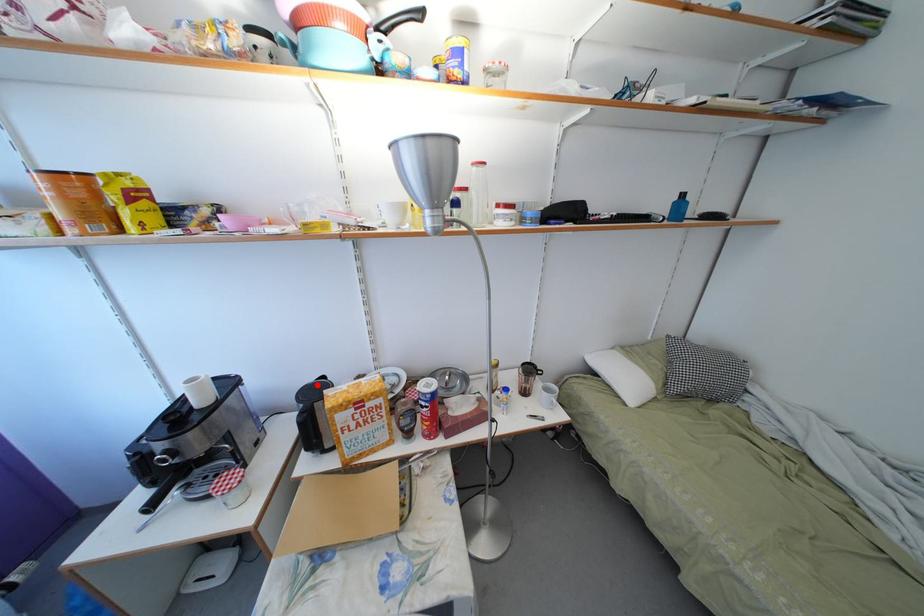
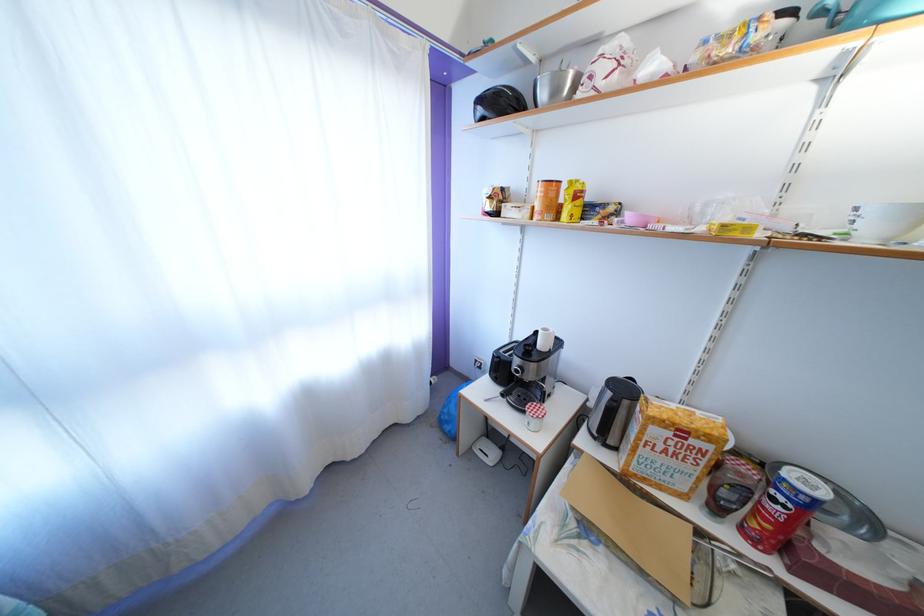
Question: A red point is marked in image1. In image2, is the corresponding 3D point closer to the camera or farther? Reply with the corresponding letter.

Choices:
 (A) The corresponding 3D point is closer.
 (B) The corresponding 3D point is farther.

Answer: (B)